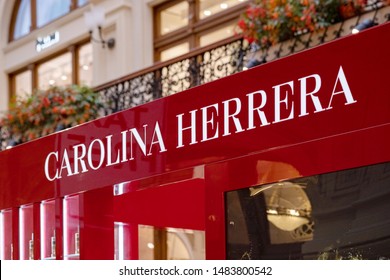
Locate an element on the screen. The height and width of the screenshot is (280, 390). bottom edge of windows is located at coordinates (19, 20), (45, 11).